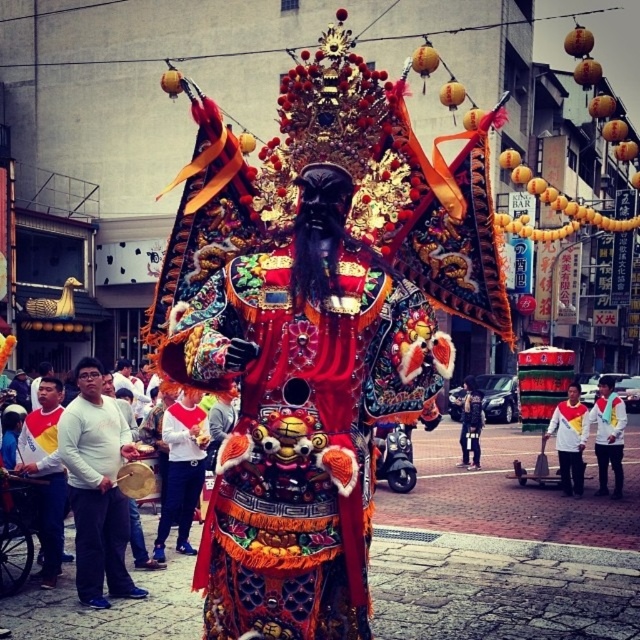
You are a photographer trying to capture the richly embroidered robe at center and the white matte drum at left in a single frame. Based on their positions, which object will appear closer to the camera in your photo?

The richly embroidered robe at center appears closer to the camera because it is positioned in front of the white matte drum at left.

You are a photographer trying to capture the entire scene of the festival. You notice the white matte drum at left and the dark blue fabric jacket at center. Which object should you focus on to ensure both are in frame without moving the camera?

The white matte drum at left is much taller than the dark blue fabric jacket at center, so focusing on the taller drum will help include both in the frame.

You are a photographer trying to capture the richly embroidered robe at center and the dark blue fabric jacket at center in the same frame. Which one should you focus on first to ensure both are in focus?

The richly embroidered robe at center is closer to the viewer than the dark blue fabric jacket at center, so focus on the robe first to ensure both are in focus.